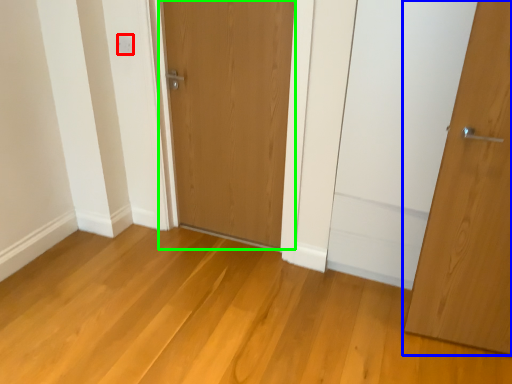
Question: Considering the real-world distances, which object is farthest from electric outlet (highlighted by a red box)? door (highlighted by a blue box) or door (highlighted by a green box)?

Choices:
 (A) door
 (B) door

Answer: (A)